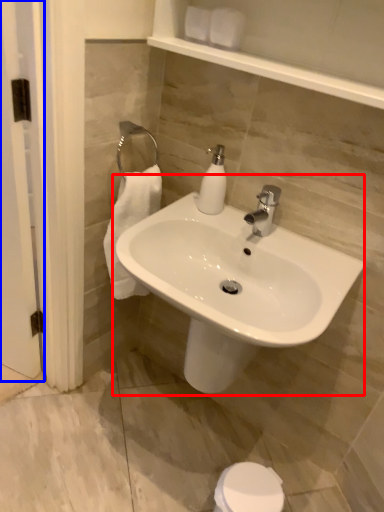
Question: Which of the following is the closest to the observer, sink (highlighted by a red box) or screen door (highlighted by a blue box)?

Choices:
 (A) sink
 (B) screen door

Answer: (A)